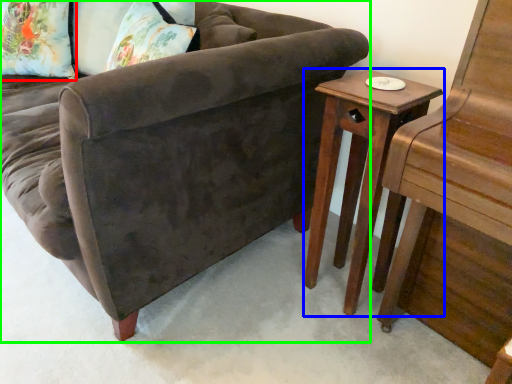
Question: Estimate the real-world distances between objects in this image. Which object is closer to pillow (highlighted by a red box), table (highlighted by a blue box) or studio couch (highlighted by a green box)?

Choices:
 (A) table
 (B) studio couch

Answer: (B)